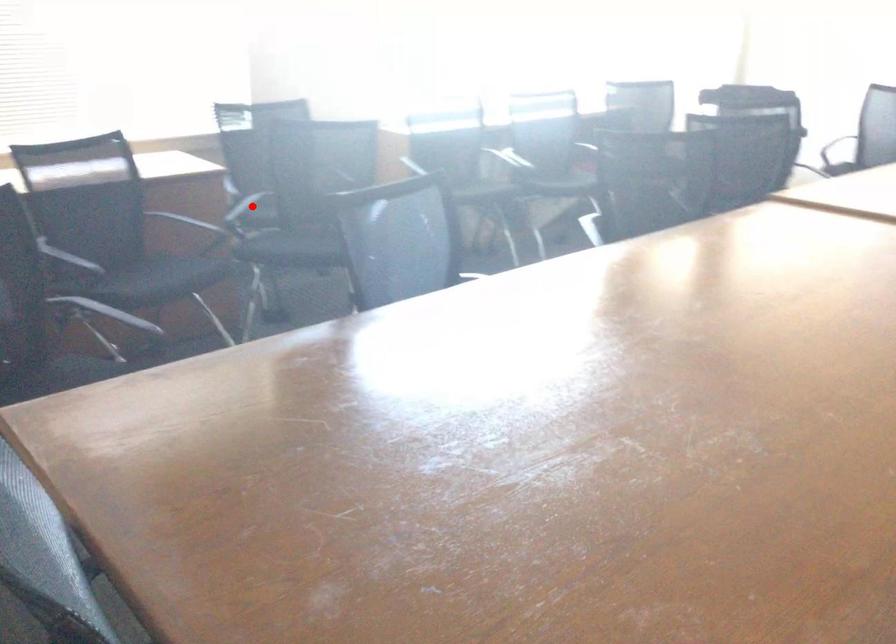
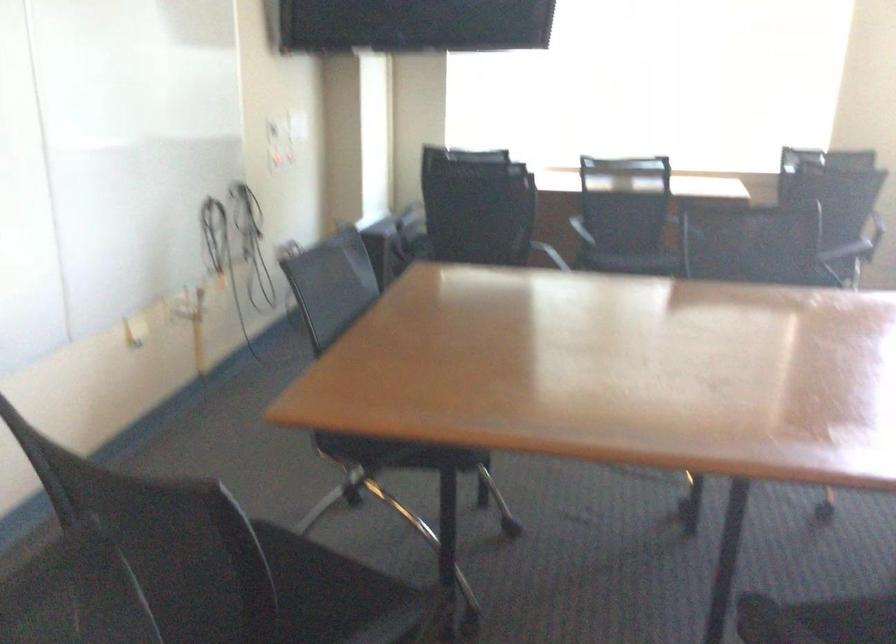
Question: I am providing you with two images of the same scene from different viewpoints. A red point is marked on the first image. At the location where the point appears in image 1, is it still visible in image 2?

Choices:
 (A) Yes
 (B) No

Answer: (B)